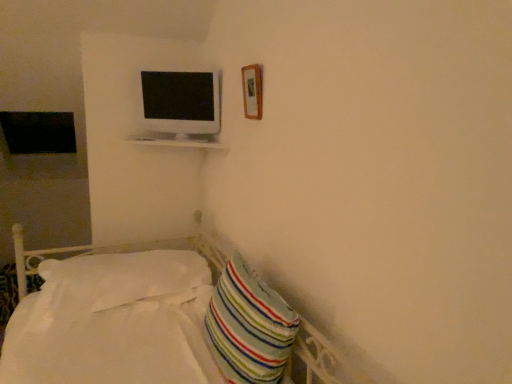
Image resolution: width=512 pixels, height=384 pixels. What do you see at coordinates (252, 91) in the screenshot?
I see `wooden frame at upper right` at bounding box center [252, 91].

Where is `wooden frame at upper right`? This screenshot has width=512, height=384. wooden frame at upper right is located at coordinates (252, 91).

The height and width of the screenshot is (384, 512). What are the coordinates of `striped fabric pillow at lower right, which is counted as the first pillow, starting from the front` in the screenshot? It's located at (249, 327).

The image size is (512, 384). What do you see at coordinates (249, 327) in the screenshot?
I see `striped fabric pillow at lower right, which is the first pillow in right-to-left order` at bounding box center [249, 327].

How much space does white soft pillow at lower left, positioned as the second pillow in front-to-back order, occupy horizontally?

white soft pillow at lower left, positioned as the second pillow in front-to-back order, is 33.10 inches wide.

Locate an element on the screen. white glossy monitor at upper center is located at coordinates (181, 103).

At what (x,y) coordinates should I click in order to perform the action: click on wooden frame at upper right. Please return your answer as a coordinate pair (x, y). Image resolution: width=512 pixels, height=384 pixels. Looking at the image, I should click on (252, 91).

The image size is (512, 384). I want to click on picture frame above the white soft pillow at lower left, the second pillow when ordered from right to left (from the image's perspective), so click(252, 91).

How much distance is there between white soft pillow at lower left, the second pillow when ordered from right to left, and wooden frame at upper right?

white soft pillow at lower left, the second pillow when ordered from right to left, and wooden frame at upper right are 38.61 inches apart.

From the image's perspective, which object appears higher, white soft pillow at lower left, positioned as the second pillow in front-to-back order, or wooden frame at upper right?

wooden frame at upper right, from the image's perspective.

From a real-world perspective, is white soft pillow at lower left, positioned as the second pillow in front-to-back order, positioned under wooden frame at upper right based on gravity?

Correct, in the physical world, white soft pillow at lower left, positioned as the second pillow in front-to-back order, is lower than wooden frame at upper right.

From the image's perspective, is striped fabric pillow at lower right, marked as the second pillow in a left-to-right arrangement, located above or below white soft pillow at lower left, positioned as the second pillow in front-to-back order?

striped fabric pillow at lower right, marked as the second pillow in a left-to-right arrangement, is below white soft pillow at lower left, positioned as the second pillow in front-to-back order.

Considering the sizes of objects striped fabric pillow at lower right, which is the first pillow in right-to-left order, and white soft pillow at lower left, placed as the first pillow when sorted from left to right, in the image provided, who is bigger, striped fabric pillow at lower right, which is the first pillow in right-to-left order, or white soft pillow at lower left, placed as the first pillow when sorted from left to right,?

With larger size is white soft pillow at lower left, placed as the first pillow when sorted from left to right.

You are a GUI agent. You are given a task and a screenshot of the screen. Output one action in this format:
    pyautogui.click(x=<x>, y=<y>)
    Task: Click on the pillow behind the striped fabric pillow at lower right, marked as the second pillow in a left-to-right arrangement
    This screenshot has height=384, width=512.
    Given the screenshot: What is the action you would take?
    pos(122,278)

Is striped fabric pillow at lower right, marked as the second pillow in a left-to-right arrangement, oriented away from white soft pillow at lower left, the second pillow when ordered from right to left?

No, striped fabric pillow at lower right, marked as the second pillow in a left-to-right arrangement, is not facing the opposite direction of white soft pillow at lower left, the second pillow when ordered from right to left.

Is striped fabric pillow at lower right, marked as the second pillow in a left-to-right arrangement, situated inside wooden frame at upper right or outside?

striped fabric pillow at lower right, marked as the second pillow in a left-to-right arrangement, exists outside the volume of wooden frame at upper right.

Considering the positions of objects striped fabric pillow at lower right, which is counted as the first pillow, starting from the front, and wooden frame at upper right in the image provided, who is more to the left, striped fabric pillow at lower right, which is counted as the first pillow, starting from the front, or wooden frame at upper right?

striped fabric pillow at lower right, which is counted as the first pillow, starting from the front, is more to the left.

Based on the photo, is striped fabric pillow at lower right, which is counted as the first pillow, starting from the front, in front of or behind wooden frame at upper right in the image?

In the image, striped fabric pillow at lower right, which is counted as the first pillow, starting from the front, appears in front of wooden frame at upper right.

Considering the relative positions of white glossy monitor at upper center and white soft pillow at lower left, positioned as the second pillow in front-to-back order, in the image provided, is white glossy monitor at upper center to the right of white soft pillow at lower left, positioned as the second pillow in front-to-back order, from the viewer's perspective?

Yes, white glossy monitor at upper center is to the right of white soft pillow at lower left, positioned as the second pillow in front-to-back order.

Does white glossy monitor at upper center have a larger size compared to white soft pillow at lower left, the second pillow when ordered from right to left?

No.

Considering the sizes of objects white glossy monitor at upper center and white soft pillow at lower left, the second pillow when ordered from right to left, in the image provided, who is thinner, white glossy monitor at upper center or white soft pillow at lower left, the second pillow when ordered from right to left,?

white glossy monitor at upper center.

Considering the relative sizes of white glossy monitor at upper center and white soft pillow at lower left, the second pillow when ordered from right to left, in the image provided, is white glossy monitor at upper center shorter than white soft pillow at lower left, the second pillow when ordered from right to left,?

No.

Is point (205, 125) closer or farther from the camera than point (252, 326)?

Point (205, 125) is positioned farther from the camera compared to point (252, 326).

From the image's perspective, count 2nd pillows downward from the white glossy monitor at upper center and point to it. Please provide its 2D coordinates.

[(249, 327)]

From a real-world perspective, is white glossy monitor at upper center beneath striped fabric pillow at lower right, marked as the second pillow in a left-to-right arrangement?

Incorrect, from a real-world perspective, white glossy monitor at upper center is higher than striped fabric pillow at lower right, marked as the second pillow in a left-to-right arrangement.

Considering the relative sizes of white soft pillow at lower left, positioned as the second pillow in front-to-back order, and striped fabric pillow at lower right, which is the first pillow in right-to-left order, in the image provided, is white soft pillow at lower left, positioned as the second pillow in front-to-back order, smaller than striped fabric pillow at lower right, which is the first pillow in right-to-left order,?

Incorrect, white soft pillow at lower left, positioned as the second pillow in front-to-back order, is not smaller in size than striped fabric pillow at lower right, which is the first pillow in right-to-left order.

How many degrees apart are the facing directions of white soft pillow at lower left, marked as the 1th pillow in a back-to-front arrangement, and striped fabric pillow at lower right, which is counted as the first pillow, starting from the front?

2.56 degrees.

Is white soft pillow at lower left, marked as the 1th pillow in a back-to-front arrangement, positioned with its back to striped fabric pillow at lower right, the second pillow when ordered from back to front?

white soft pillow at lower left, marked as the 1th pillow in a back-to-front arrangement, does not have its back to striped fabric pillow at lower right, the second pillow when ordered from back to front.

From the image's perspective, which object appears higher, white soft pillow at lower left, placed as the first pillow when sorted from left to right, or striped fabric pillow at lower right, which is counted as the first pillow, starting from the front?

white soft pillow at lower left, placed as the first pillow when sorted from left to right, from the image's perspective.

From the image's perspective, would you say white glossy monitor at upper center is shown under wooden frame at upper right?

No, from the image's perspective, white glossy monitor at upper center is not beneath wooden frame at upper right.

Can you tell me how much white glossy monitor at upper center and wooden frame at upper right differ in facing direction?

There is a 56.9-degree angle between the facing directions of white glossy monitor at upper center and wooden frame at upper right.

Can you confirm if white glossy monitor at upper center is positioned to the right of wooden frame at upper right?

Incorrect, white glossy monitor at upper center is not on the right side of wooden frame at upper right.

This screenshot has width=512, height=384. Identify the location of picture frame above the white soft pillow at lower left, marked as the 1th pillow in a back-to-front arrangement (from a real-world perspective). (252, 91).

Where is `pillow on the left of striped fabric pillow at lower right, the second pillow when ordered from back to front`? pillow on the left of striped fabric pillow at lower right, the second pillow when ordered from back to front is located at coordinates (122, 278).

Considering their positions, is white soft pillow at lower left, the second pillow when ordered from right to left, positioned closer to white glossy monitor at upper center than wooden frame at upper right?

Result: Among the two, wooden frame at upper right is located nearer to white glossy monitor at upper center.

When comparing their distances from white soft pillow at lower left, marked as the 1th pillow in a back-to-front arrangement, does wooden frame at upper right or striped fabric pillow at lower right, which is counted as the first pillow, starting from the front, seem further?

The object further to white soft pillow at lower left, marked as the 1th pillow in a back-to-front arrangement, is wooden frame at upper right.

When comparing their distances from white glossy monitor at upper center, does wooden frame at upper right or white soft pillow at lower left, the second pillow when ordered from right to left, seem closer?

Based on the image, wooden frame at upper right appears to be nearer to white glossy monitor at upper center.

Looking at this image, based on their spatial positions, is striped fabric pillow at lower right, which is the first pillow in right-to-left order, or wooden frame at upper right further from white glossy monitor at upper center?

striped fabric pillow at lower right, which is the first pillow in right-to-left order, is positioned further to the anchor white glossy monitor at upper center.

Estimate the real-world distances between objects in this image. Which object is closer to white glossy monitor at upper center, striped fabric pillow at lower right, which is counted as the first pillow, starting from the front, or white soft pillow at lower left, the second pillow when ordered from right to left?

The object closer to white glossy monitor at upper center is white soft pillow at lower left, the second pillow when ordered from right to left.

Estimate the real-world distances between objects in this image. Which object is further from wooden frame at upper right, striped fabric pillow at lower right, marked as the second pillow in a left-to-right arrangement, or white soft pillow at lower left, placed as the first pillow when sorted from left to right?

white soft pillow at lower left, placed as the first pillow when sorted from left to right, lies further to wooden frame at upper right than the other object.

From the image, which object appears to be nearer to white soft pillow at lower left, marked as the 1th pillow in a back-to-front arrangement, white glossy monitor at upper center or wooden frame at upper right?

Based on the image, white glossy monitor at upper center appears to be nearer to white soft pillow at lower left, marked as the 1th pillow in a back-to-front arrangement.

Based on their spatial positions, is white glossy monitor at upper center or wooden frame at upper right further from striped fabric pillow at lower right, which is counted as the first pillow, starting from the front?

Based on the image, white glossy monitor at upper center appears to be further to striped fabric pillow at lower right, which is counted as the first pillow, starting from the front.

Where is `pillow between wooden frame at upper right and striped fabric pillow at lower right, marked as the second pillow in a left-to-right arrangement, in the up-down direction`? The width and height of the screenshot is (512, 384). pillow between wooden frame at upper right and striped fabric pillow at lower right, marked as the second pillow in a left-to-right arrangement, in the up-down direction is located at coordinates [x=122, y=278].

Find the location of `picture frame that lies between white glossy monitor at upper center and white soft pillow at lower left, positioned as the second pillow in front-to-back order, from top to bottom`. picture frame that lies between white glossy monitor at upper center and white soft pillow at lower left, positioned as the second pillow in front-to-back order, from top to bottom is located at coordinates 252,91.

Where is `pillow between white glossy monitor at upper center and striped fabric pillow at lower right, the second pillow when ordered from back to front, from top to bottom`? pillow between white glossy monitor at upper center and striped fabric pillow at lower right, the second pillow when ordered from back to front, from top to bottom is located at coordinates (122, 278).

This screenshot has height=384, width=512. What are the coordinates of `picture frame between white glossy monitor at upper center and striped fabric pillow at lower right, marked as the second pillow in a left-to-right arrangement, in the vertical direction` in the screenshot? It's located at (252, 91).